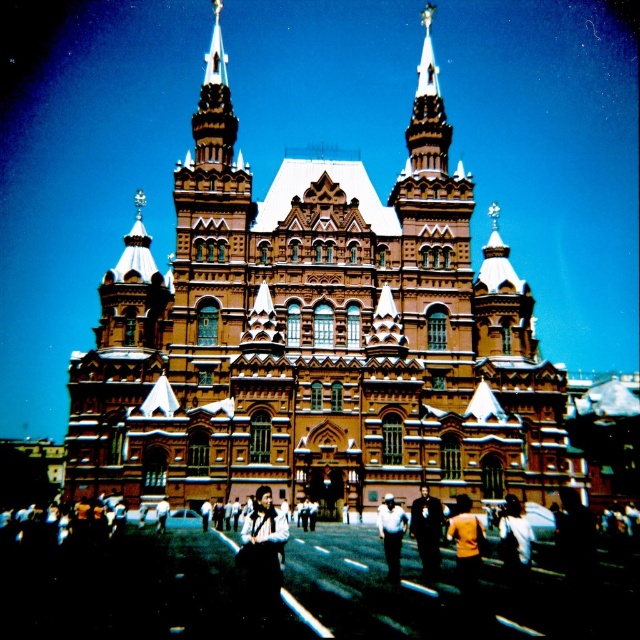
Question: Does orange shirt at center appear on the left side of white cotton shirt at center?

Choices:
 (A) no
 (B) yes

Answer: (A)

Question: Where is orange shirt at center located in relation to light brown leather jacket at center in the image?

Choices:
 (A) below
 (B) above

Answer: (B)

Question: Which point is farther to the camera?

Choices:
 (A) white shirt at center
 (B) white cotton shirt at center
 (C) brown stone church at center
 (D) gold ornate spire at upper center

Answer: (D)

Question: Among these points, which one is nearest to the camera?

Choices:
 (A) (422, 548)
 (B) (454, 541)
 (C) (156, 508)

Answer: (A)

Question: Which of the following is the closest to the observer?

Choices:
 (A) light brown leather jacket at center
 (B) orange shirt at center

Answer: (B)

Question: In this image, where is brown stone church at center located relative to orange shirt at center?

Choices:
 (A) above
 (B) below

Answer: (A)